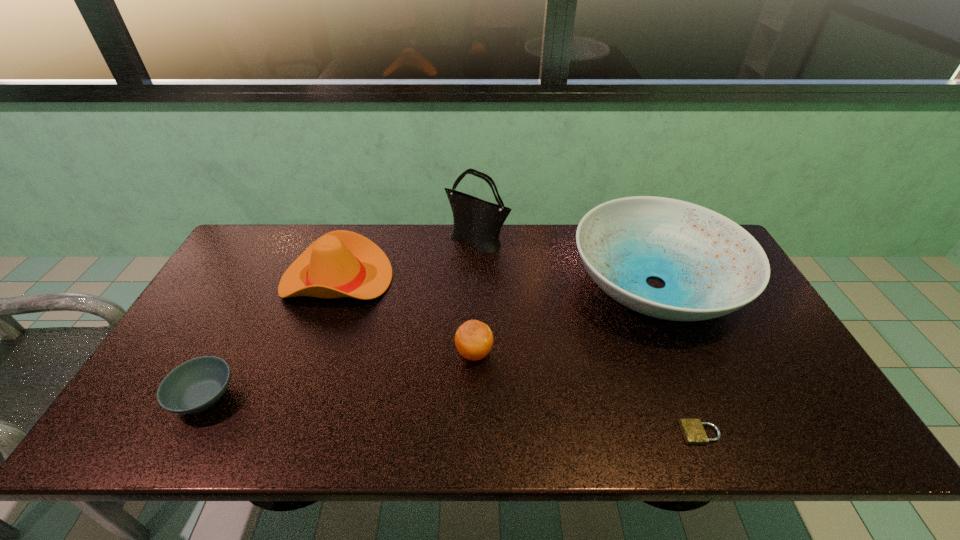
You are a GUI agent. You are given a task and a screenshot of the screen. Output one action in this format:
    pyautogui.click(x=<x>, y=<y>)
    Task: Click on the object located at the right edge
    The width and height of the screenshot is (960, 540).
    Given the screenshot: What is the action you would take?
    pyautogui.click(x=711, y=266)

This screenshot has width=960, height=540. Identify the location of object located in the near left corner section of the desktop. (197, 384).

You are a GUI agent. You are given a task and a screenshot of the screen. Output one action in this format:
    pyautogui.click(x=<x>, y=<y>)
    Task: Click on the object present at the far right corner
    
    Given the screenshot: What is the action you would take?
    pyautogui.click(x=711, y=266)

Identify the location of vacant space at the near edge of the desktop. pyautogui.click(x=371, y=436).

In order to click on vacant space at the left edge of the desktop in this screenshot , I will do `click(215, 308)`.

This screenshot has width=960, height=540. Find the location of `free region at the right edge of the desktop`. free region at the right edge of the desktop is located at coordinates (748, 321).

At what (x,y) coordinates should I click in order to perform the action: click on vacant space at the far left corner of the desktop. Please return your answer as a coordinate pair (x, y). This screenshot has height=540, width=960. Looking at the image, I should click on (286, 230).

This screenshot has height=540, width=960. In the image, there is a desktop. Identify the location of vacant space at the near left corner. (197, 415).

This screenshot has width=960, height=540. I want to click on vacant area that lies between the orange and the soup bowl, so click(339, 375).

The height and width of the screenshot is (540, 960). Find the location of `free spot between the shortest object and the cowboy hat`. free spot between the shortest object and the cowboy hat is located at coordinates (518, 356).